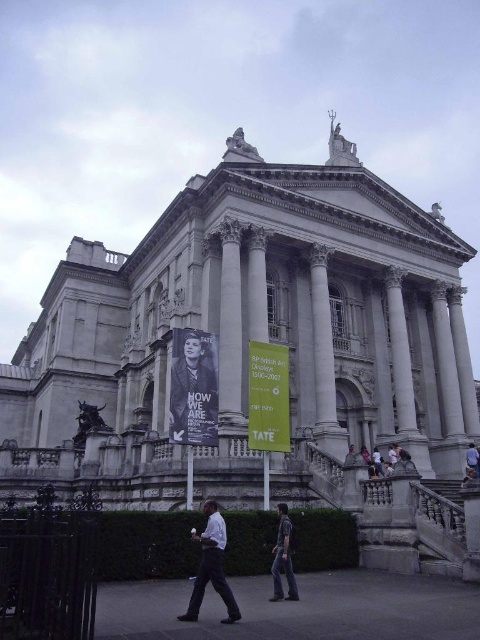
Between black paper poster at center and striped shirt at center, which one has less height?

With less height is striped shirt at center.

Image resolution: width=480 pixels, height=640 pixels. I want to click on black paper poster at center, so click(193, 388).

Is black paper poster at center positioned in front of white marble pillar at center?

Yes, it is.

Which is more to the left, black paper poster at center or white marble pillar at center?

From the viewer's perspective, black paper poster at center appears more on the left side.

Between point (211, 445) and point (240, 333), which one is positioned behind?

The point (240, 333) is behind.

Image resolution: width=480 pixels, height=640 pixels. I want to click on black paper poster at center, so click(193, 388).

What do you see at coordinates (267, 397) in the screenshot? This screenshot has width=480, height=640. I see `yellow paper poster at center` at bounding box center [267, 397].

Is yellow paper poster at center taller than striped shirt at center?

Correct, yellow paper poster at center is much taller as striped shirt at center.

Locate an element on the screen. yellow paper poster at center is located at coordinates tap(267, 397).